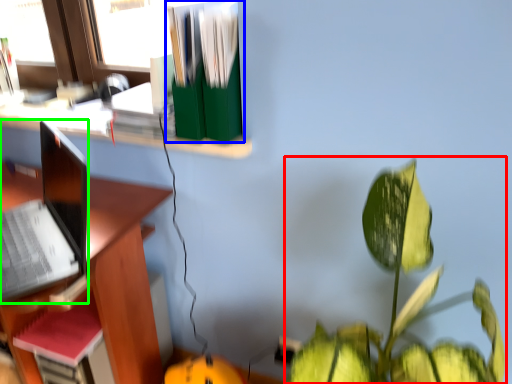
Question: Based on their relative distances, which object is farther from houseplant (highlighted by a red box)? Choose from book (highlighted by a blue box) and laptop (highlighted by a green box).

Choices:
 (A) book
 (B) laptop

Answer: (B)